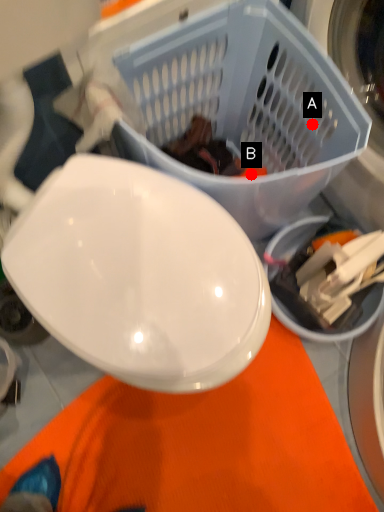
Question: Two points are circled on the image, labeled by A and B beside each circle. Which point is further to the camera?

Choices:
 (A) A is further
 (B) B is further

Answer: (A)